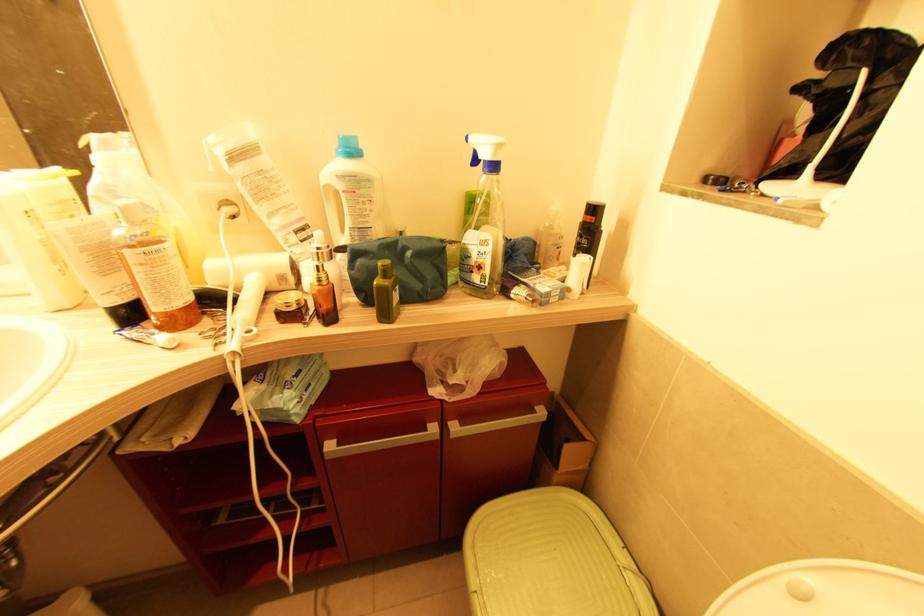
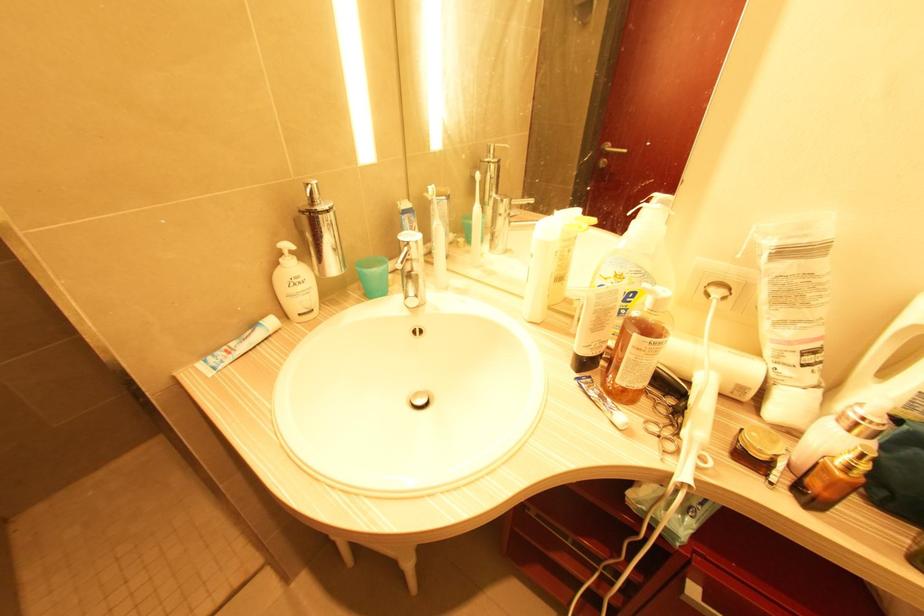
In the second image, find the point that corresponds to point (69, 215) in the first image.

(569, 249)